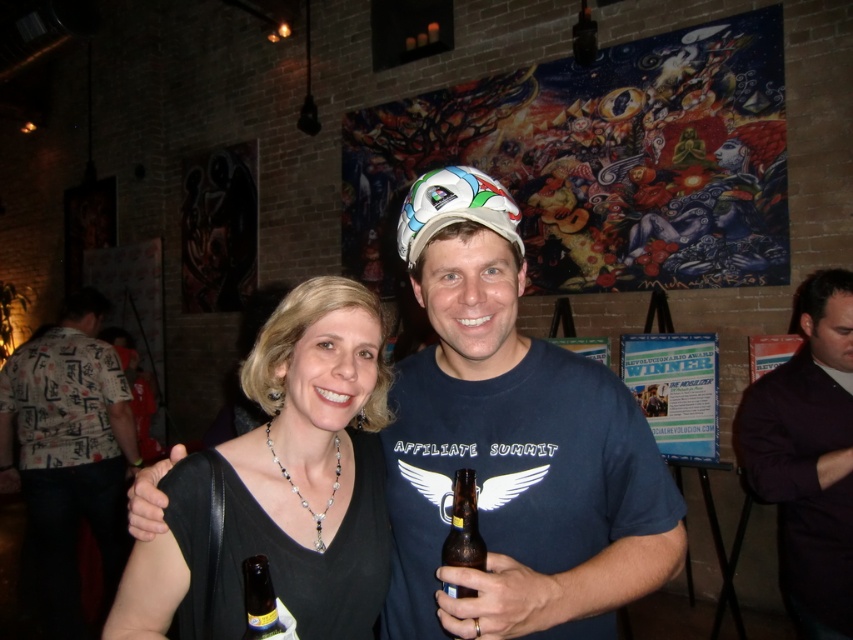
You are standing at the point labeled as point (45, 483) in the image. A friend is located 10 feet away from you in the direction of the mural. Can they see the colorful mural behind the subjects?

The point labeled as point (45, 483) is 10.41 feet away from the viewer. Since your friend is 10 feet away from you in the direction of the mural, they would be approximately 0.41 feet closer to the mural than your position. However, the description does not provide information about any obstructions between the point and the mural. Assuming there are no obstructions, they should be able to see the mural.